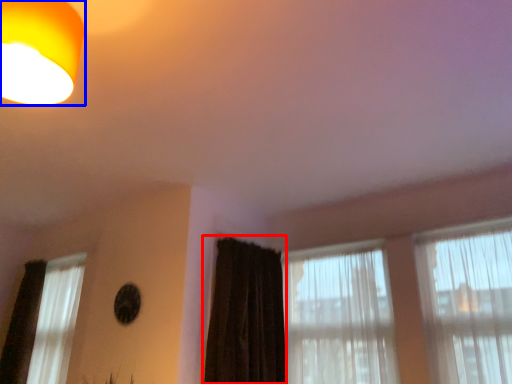
Question: Which point is closer to the camera, curtain (highlighted by a red box) or lamp (highlighted by a blue box)?

Choices:
 (A) curtain
 (B) lamp

Answer: (B)